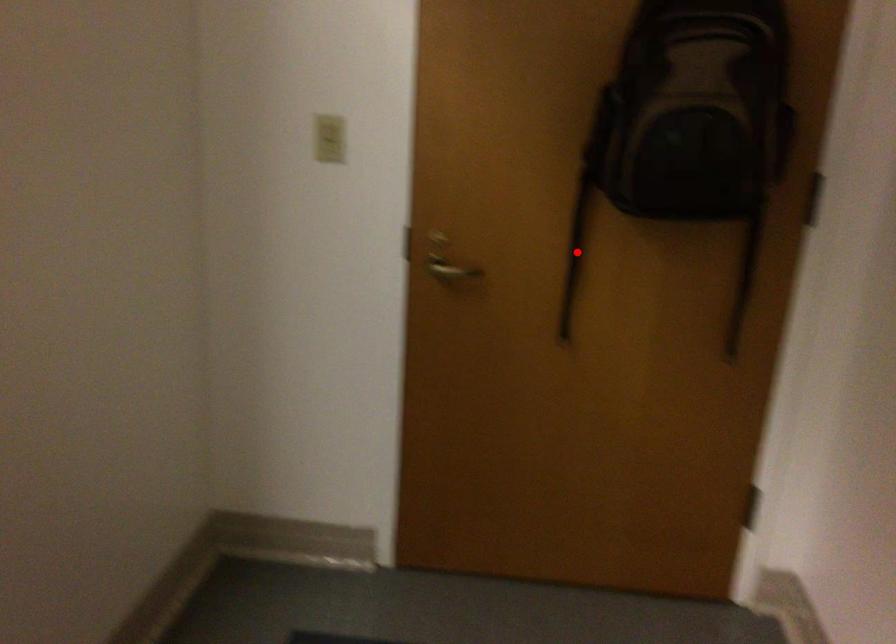
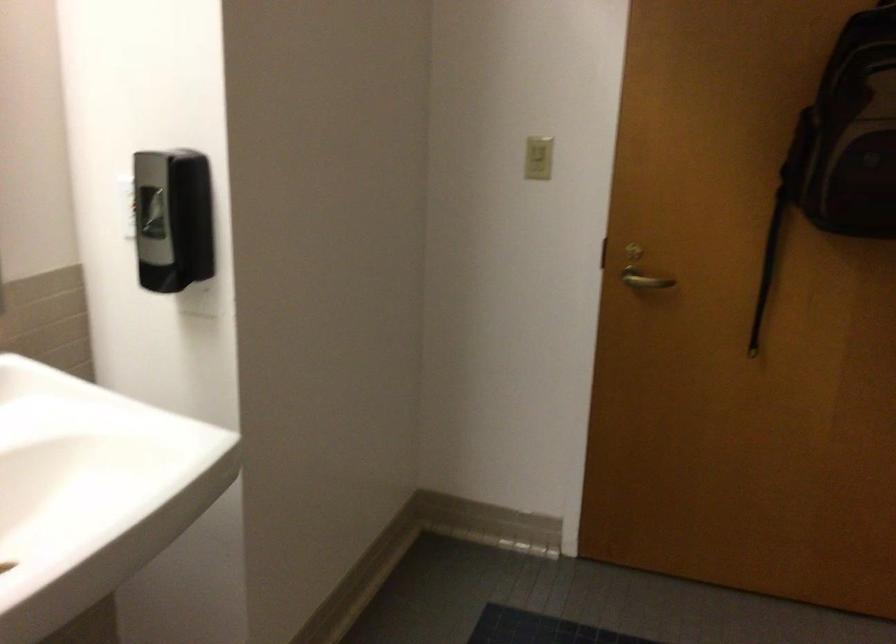
Find the pixel in the second image that matches the highlighted location in the first image.

(767, 267)